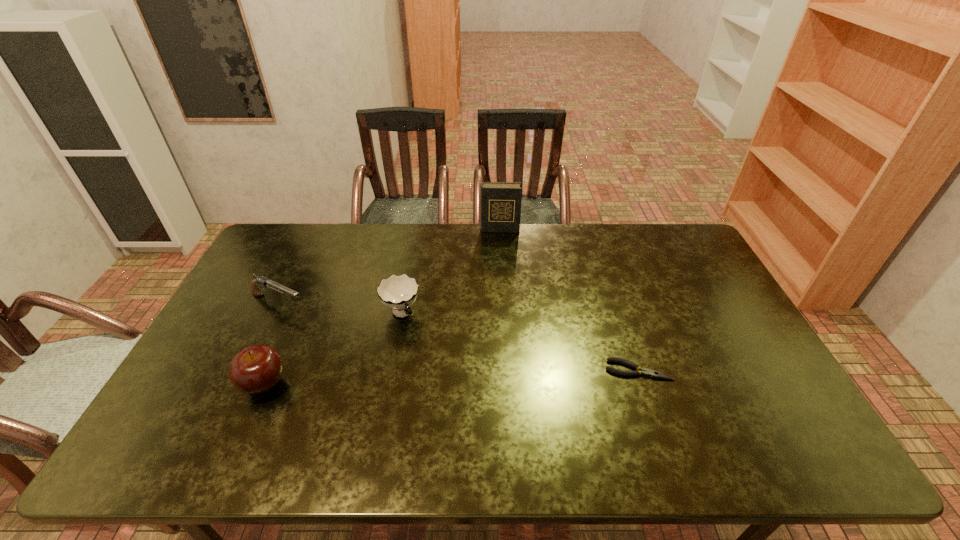
Find the location of a particular element. the second tallest object is located at coordinates 256,369.

Find the location of a particular element. This screenshot has width=960, height=540. pliers is located at coordinates (646, 372).

Where is `the shortest object`? This screenshot has height=540, width=960. the shortest object is located at coordinates (646, 372).

Where is `the third object from left to right`? the third object from left to right is located at coordinates [398, 292].

Where is `gun`? The height and width of the screenshot is (540, 960). gun is located at coordinates (262, 282).

Where is `the farthest object`? The width and height of the screenshot is (960, 540). the farthest object is located at coordinates (500, 201).

This screenshot has width=960, height=540. Identify the location of the second object from right to left. (500, 201).

Where is `vacant space located on the back of the fourth shortest object`? vacant space located on the back of the fourth shortest object is located at coordinates (285, 338).

Where is `vacant space located 0.200m on the back of the pliers`? This screenshot has height=540, width=960. vacant space located 0.200m on the back of the pliers is located at coordinates (618, 308).

Locate an element on the screen. free location located on the side of the cup with the handle is located at coordinates (428, 359).